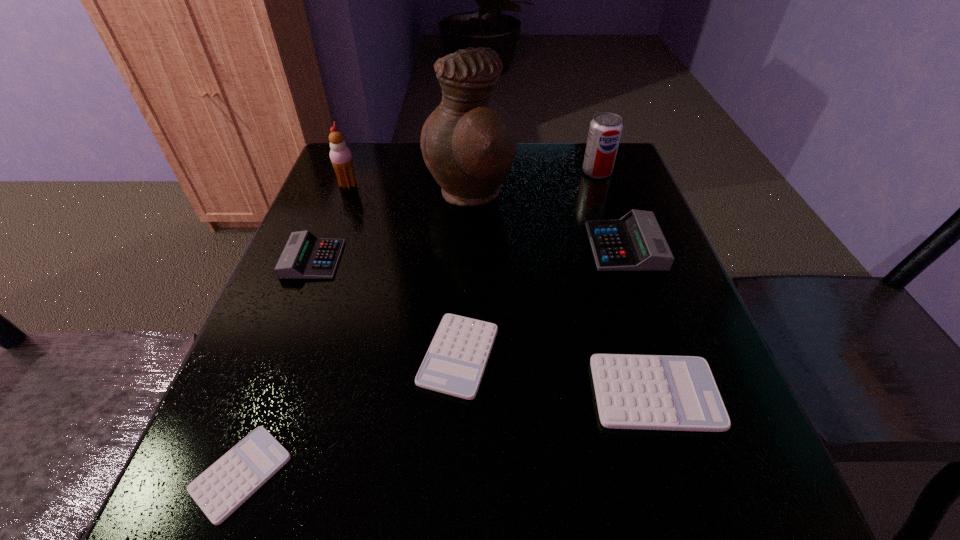
The image size is (960, 540). I want to click on object that is at the far right corner, so tap(605, 130).

This screenshot has height=540, width=960. I want to click on vacant space at the far edge, so click(x=537, y=176).

Identify the location of free region at the near edge of the desktop. (420, 509).

Where is `vacant space at the left edge of the desktop`? Image resolution: width=960 pixels, height=540 pixels. vacant space at the left edge of the desktop is located at coordinates (279, 309).

Locate an element on the screen. This screenshot has width=960, height=540. empty location between the fifth shortest object and the fourth shortest calculator is located at coordinates (469, 253).

Locate an element on the screen. vacant space that's between the fourth tallest calculator and the rightmost white calculator is located at coordinates (557, 375).

Where is `free spot between the third shortest calculator and the shortest calculator`? The image size is (960, 540). free spot between the third shortest calculator and the shortest calculator is located at coordinates (448, 434).

Identify the location of free space between the fourth tallest calculator and the soda. tap(528, 264).

Locate an element on the screen. The width and height of the screenshot is (960, 540). vacant area that lies between the smaller gray calculator and the soda is located at coordinates (455, 216).

Locate an element on the screen. empty space between the bigger gray calculator and the soda is located at coordinates (611, 209).